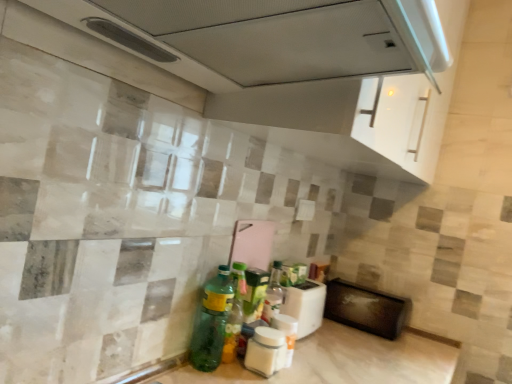
Question: Is the depth of white matte jar at center, the 2th bottle from the right, greater than that of white plastic toaster at lower center, the second appliance in the right-to-left sequence?

Choices:
 (A) yes
 (B) no

Answer: (B)

Question: Is white matte jar at center, which is counted as the second bottle, starting from the left, positioned beyond the bounds of white plastic toaster at lower center, the 1th appliance viewed from the front?

Choices:
 (A) no
 (B) yes

Answer: (B)

Question: From the image's perspective, is white matte jar at center, the 2th bottle from the right, on white plastic toaster at lower center, the second appliance in the right-to-left sequence?

Choices:
 (A) no
 (B) yes

Answer: (A)

Question: Is white matte jar at center, the 2th bottle from the right, positioned far away from white plastic toaster at lower center, the 2th appliance from the back?

Choices:
 (A) yes
 (B) no

Answer: (B)

Question: Is white matte jar at center, the 2th bottle from the right, bigger than white plastic toaster at lower center, the 1th appliance viewed from the front?

Choices:
 (A) yes
 (B) no

Answer: (B)

Question: From the image's perspective, is white matte jar at center, the 2th bottle from the right, under white plastic toaster at lower center, the 1th appliance viewed from the front?

Choices:
 (A) no
 (B) yes

Answer: (B)

Question: Is green glass bottle at lower center, the 1th bottle positioned from the left, touching black matte microwave at lower right, which ranks as the second appliance in left-to-right order?

Choices:
 (A) yes
 (B) no

Answer: (B)

Question: Does green glass bottle at lower center, the 1th bottle positioned from the left, come in front of black matte microwave at lower right, the 1th appliance positioned from the back?

Choices:
 (A) yes
 (B) no

Answer: (A)

Question: Considering the relative sizes of green glass bottle at lower center, the 1th bottle positioned from the left, and black matte microwave at lower right, positioned as the 2th appliance in front-to-back order, in the image provided, is green glass bottle at lower center, the 1th bottle positioned from the left, bigger than black matte microwave at lower right, positioned as the 2th appliance in front-to-back order,?

Choices:
 (A) yes
 (B) no

Answer: (B)

Question: Is green glass bottle at lower center, the 1th bottle positioned from the left, aimed at black matte microwave at lower right, the 1th appliance positioned from the back?

Choices:
 (A) no
 (B) yes

Answer: (A)

Question: From a real-world perspective, is green glass bottle at lower center, the 1th bottle positioned from the left, physically below black matte microwave at lower right, which ranks as the first appliance in right-to-left order?

Choices:
 (A) yes
 (B) no

Answer: (B)

Question: Considering the relative sizes of green glass bottle at lower center, the 1th bottle positioned from the left, and black matte microwave at lower right, positioned as the 2th appliance in front-to-back order, in the image provided, is green glass bottle at lower center, the 1th bottle positioned from the left, taller than black matte microwave at lower right, positioned as the 2th appliance in front-to-back order,?

Choices:
 (A) yes
 (B) no

Answer: (A)

Question: Can we say white matte jar at center, which is counted as the second bottle, starting from the left, lies outside black matte microwave at lower right, the 1th appliance positioned from the back?

Choices:
 (A) yes
 (B) no

Answer: (A)